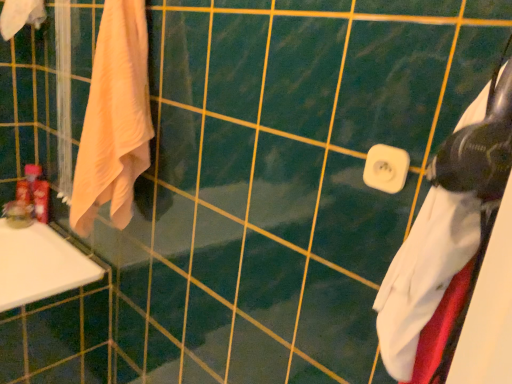
Question: Is matte plastic toiletries at left, the first toiletry positioned from the left, positioned far away from light peach cotton towel at left, which appears as the second towel when viewed from the left?

Choices:
 (A) yes
 (B) no

Answer: (B)

Question: Considering the relative sizes of matte plastic toiletries at left, acting as the 2th toiletry starting from the right, and light peach cotton towel at left, which appears as the second towel when viewed from the left, in the image provided, is matte plastic toiletries at left, acting as the 2th toiletry starting from the right, taller than light peach cotton towel at left, which appears as the second towel when viewed from the left,?

Choices:
 (A) no
 (B) yes

Answer: (A)

Question: Is matte plastic toiletries at left, acting as the 2th toiletry starting from the right, facing towards light peach cotton towel at left, arranged as the second towel when viewed from the right?

Choices:
 (A) no
 (B) yes

Answer: (B)

Question: Is matte plastic toiletries at left, the first toiletry positioned from the left, further to camera compared to light peach cotton towel at left, arranged as the second towel when viewed from the right?

Choices:
 (A) no
 (B) yes

Answer: (B)

Question: Does matte plastic toiletries at left, acting as the 2th toiletry starting from the right, have a lesser height compared to light peach cotton towel at left, arranged as the second towel when viewed from the right?

Choices:
 (A) yes
 (B) no

Answer: (A)

Question: Relative to matte plastic toothpaste tube at left, positioned as the first toiletry in right-to-left order, is white plastic towel bar at center in front or behind?

Choices:
 (A) behind
 (B) front

Answer: (B)

Question: Is white plastic towel bar at center taller or shorter than matte plastic toothpaste tube at left, the 2th toiletry in the left-to-right sequence?

Choices:
 (A) tall
 (B) short

Answer: (B)

Question: Is white plastic towel bar at center wider or thinner than matte plastic toothpaste tube at left, positioned as the first toiletry in right-to-left order?

Choices:
 (A) thin
 (B) wide

Answer: (A)

Question: From the image's perspective, is white plastic towel bar at center above or below matte plastic toothpaste tube at left, the 2th toiletry in the left-to-right sequence?

Choices:
 (A) below
 (B) above

Answer: (B)

Question: Based on their sizes in the image, would you say light peach cotton towel at left, which appears as the second towel when viewed from the left, is bigger or smaller than white plastic towel bar at center?

Choices:
 (A) big
 (B) small

Answer: (A)

Question: From the image's perspective, is light peach cotton towel at left, positioned as the 2th towel in back-to-front order, positioned above or below white plastic towel bar at center?

Choices:
 (A) above
 (B) below

Answer: (A)

Question: Considering the positions of light peach cotton towel at left, positioned as the 2th towel in back-to-front order, and white plastic towel bar at center in the image, is light peach cotton towel at left, positioned as the 2th towel in back-to-front order, taller or shorter than white plastic towel bar at center?

Choices:
 (A) short
 (B) tall

Answer: (B)

Question: Would you say light peach cotton towel at left, the second towel when ordered from front to back, is inside or outside white plastic towel bar at center?

Choices:
 (A) inside
 (B) outside

Answer: (B)

Question: Choose the correct answer: Is matte plastic toothpaste tube at left, the 2th toiletry in the left-to-right sequence, inside matte plastic toiletries at left, the first toiletry positioned from the left, or outside it?

Choices:
 (A) outside
 (B) inside

Answer: (A)

Question: Considering their positions, is matte plastic toothpaste tube at left, positioned as the first toiletry in right-to-left order, located in front of or behind matte plastic toiletries at left, acting as the 2th toiletry starting from the right?

Choices:
 (A) behind
 (B) front

Answer: (B)